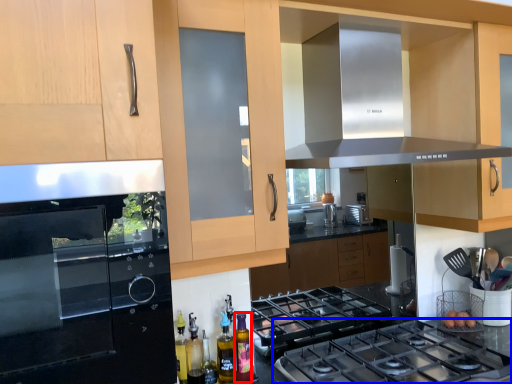
Question: Which object is closer to the camera taking this photo, bottle (highlighted by a red box) or gas stove (highlighted by a blue box)?

Choices:
 (A) bottle
 (B) gas stove

Answer: (B)